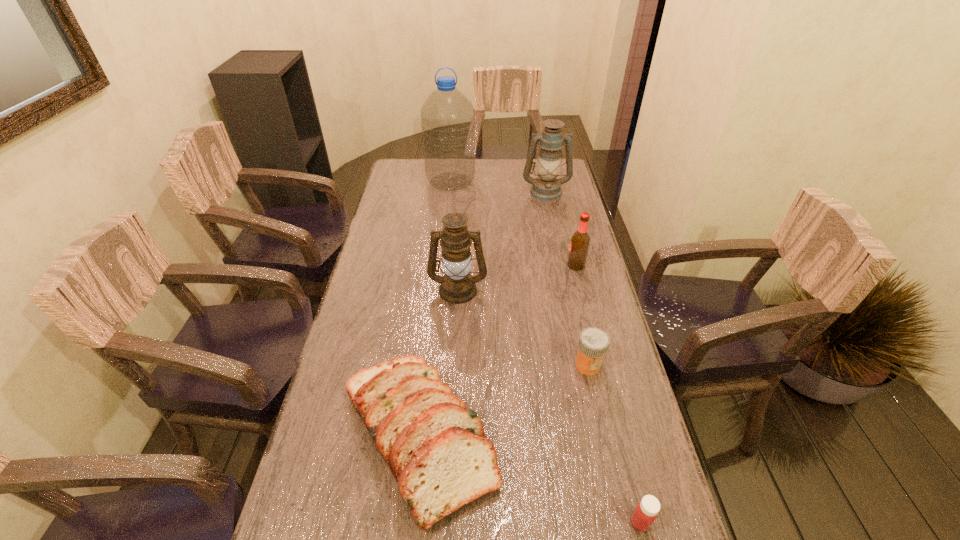
Locate an element on the screen. Image resolution: width=960 pixels, height=540 pixels. water jug present at the left edge is located at coordinates (447, 117).

Image resolution: width=960 pixels, height=540 pixels. Identify the location of bread positioned at the left edge. (436, 449).

The height and width of the screenshot is (540, 960). I want to click on oil lamp present at the right edge, so click(x=547, y=187).

Image resolution: width=960 pixels, height=540 pixels. In order to click on beer bottle that is at the right edge in this screenshot , I will do `click(580, 240)`.

Identify the location of object present at the far left corner. (447, 117).

You are a GUI agent. You are given a task and a screenshot of the screen. Output one action in this format:
    pyautogui.click(x=<x>, y=<y>)
    Task: Click on the object that is at the far right corner
    This screenshot has height=540, width=960.
    Given the screenshot: What is the action you would take?
    pyautogui.click(x=547, y=187)

The width and height of the screenshot is (960, 540). I want to click on vacant space at the far edge of the desktop, so click(500, 167).

In the image, there is a desktop. In order to click on vacant space at the left edge in this screenshot , I will do `click(356, 470)`.

Where is `vacant space at the right edge of the desktop`? The image size is (960, 540). vacant space at the right edge of the desktop is located at coordinates pyautogui.click(x=567, y=364).

Image resolution: width=960 pixels, height=540 pixels. In order to click on vacant area at the far left corner of the desktop in this screenshot , I will do `click(418, 168)`.